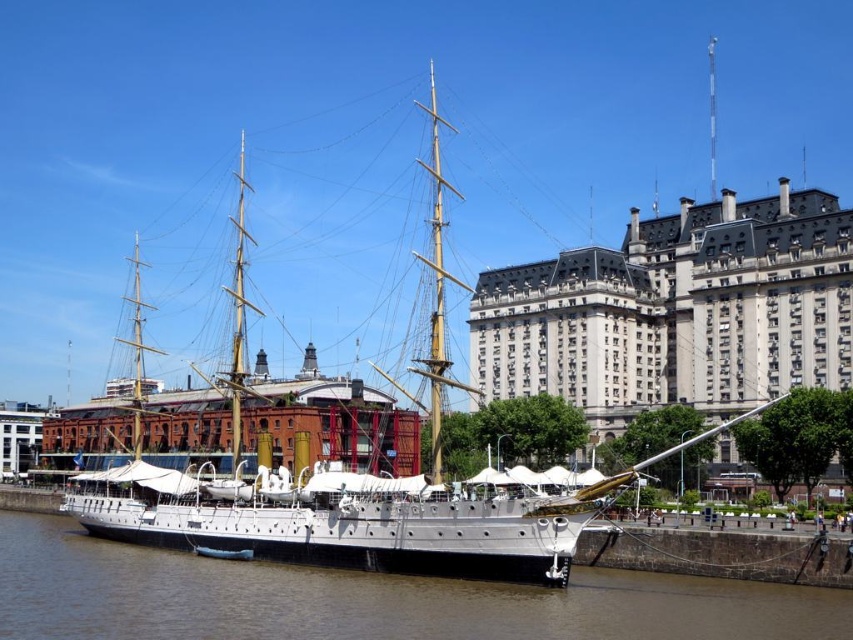
Question: Is the position of white stone building at center less distant than that of white polished wood ship at center?

Choices:
 (A) yes
 (B) no

Answer: (B)

Question: Which of the following is the farthest from the observer?

Choices:
 (A) (788, 356)
 (B) (392, 563)

Answer: (A)

Question: Which of the following is the farthest from the observer?

Choices:
 (A) white polished wood ship at center
 (B) white stone building at center
 (C) brown water at lower center

Answer: (B)

Question: Among these objects, which one is farthest from the camera?

Choices:
 (A) brown water at lower center
 (B) white stone building at center
 (C) white polished wood ship at center

Answer: (B)

Question: Is white stone building at center smaller than brown water at lower center?

Choices:
 (A) yes
 (B) no

Answer: (B)

Question: Where is white stone building at center located in relation to white polished wood ship at center in the image?

Choices:
 (A) left
 (B) right

Answer: (B)